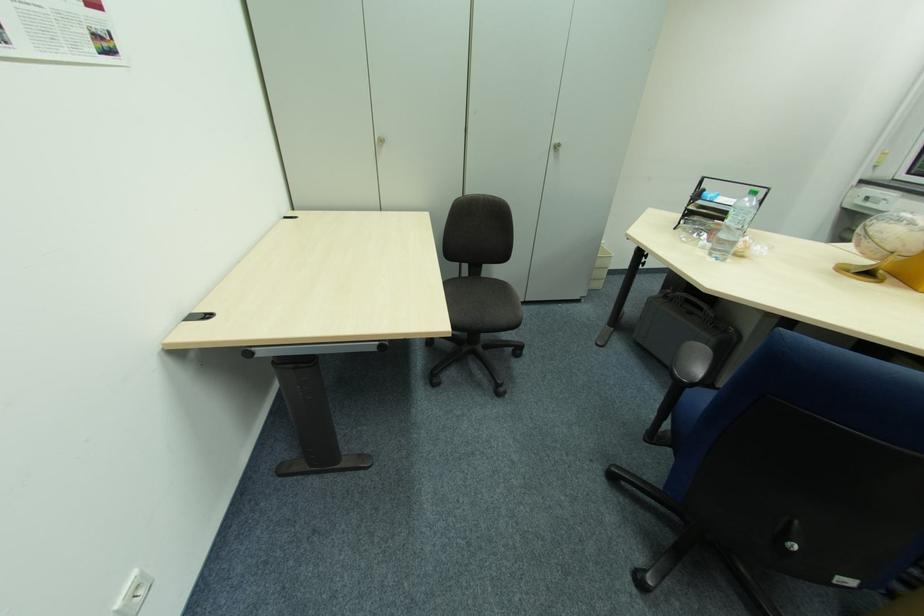
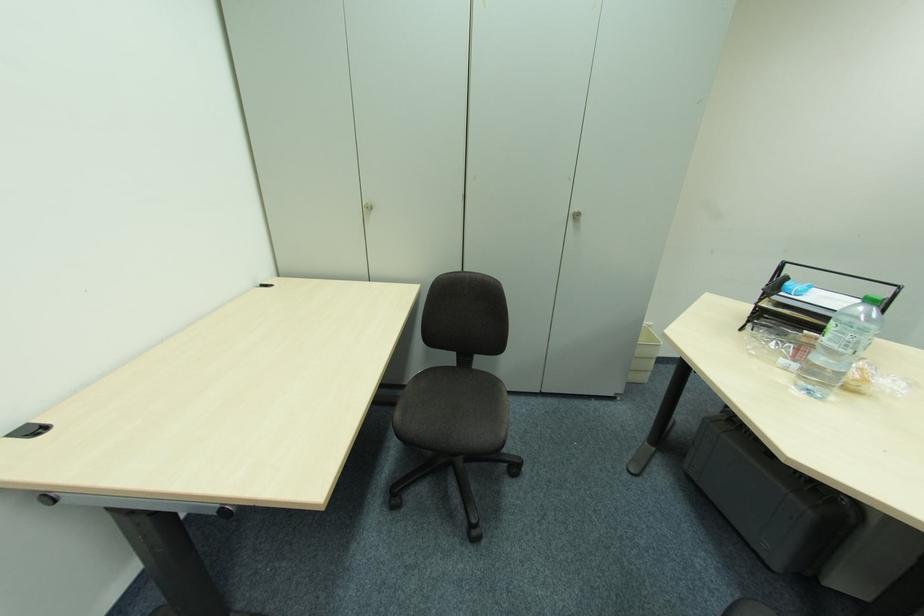
Which direction would the cameraman need to move to produce the second image?

The movement direction of the cameraman is right, forward.